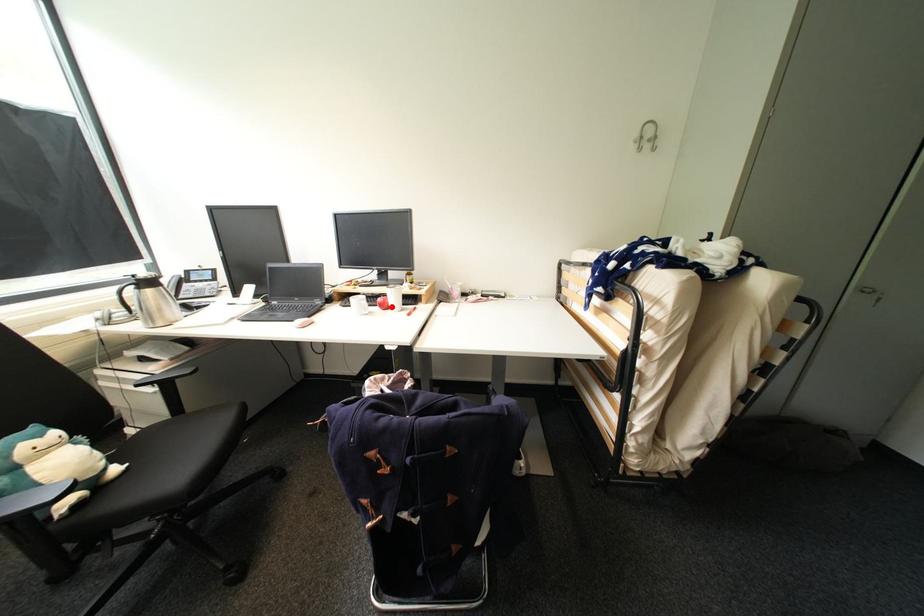
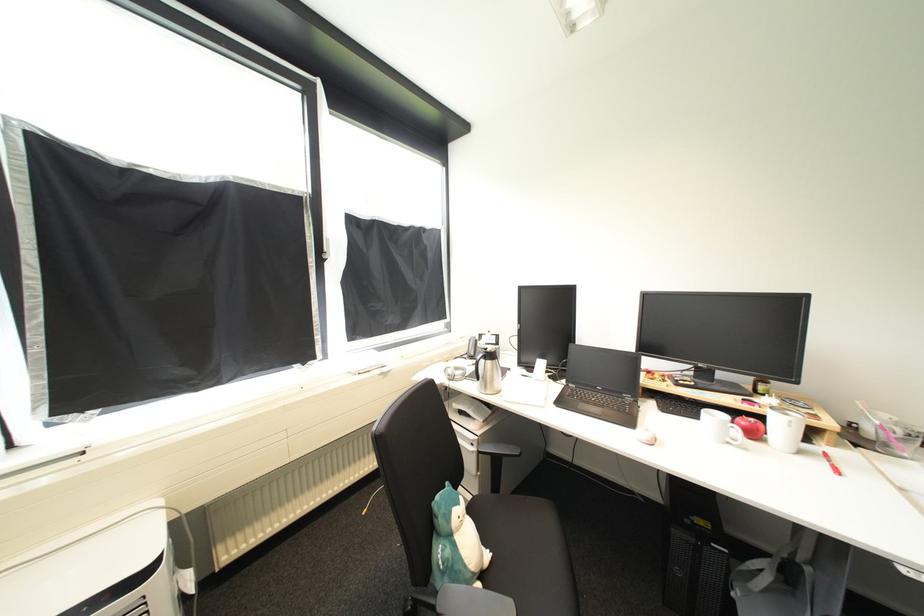
Locate, in the second image, the point that corresponds to the highlighted location in the first image.

(761, 436)